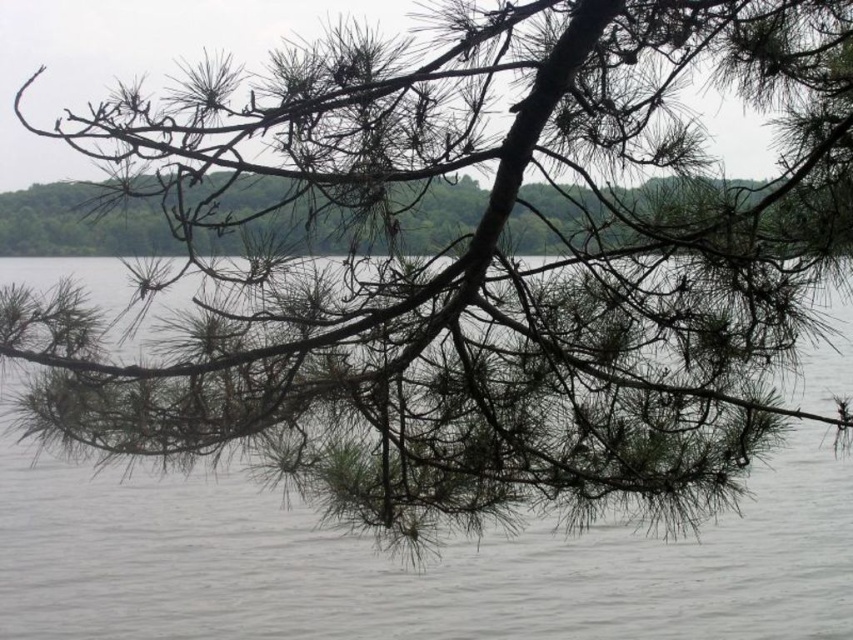
You are an artist setting up an easel to paint the scene. You want to focus on the largest area in the image. Which object should you choose between the gray matte water at center and the brown textured pine branch at center?

The gray matte water at center has a larger size compared to the brown textured pine branch at center, so you should focus on the gray matte water at center for the largest area.

You are standing in a forest and see the brown textured pine branch at center and the gray matte water at center. Which object is closer to the ground?

The gray matte water at center is below the brown textured pine branch at center, so the gray matte water at center is closer to the ground.

You are standing in front of the pine branch and want to touch both points on it. Which point, point (799, 525) or point (558, 198), will you reach first as you move towards the branch?

Point (799, 525) is closer to you than point (558, 198), so you will reach point (799, 525) first.